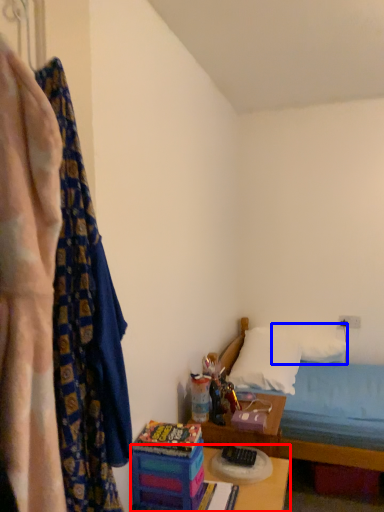
Question: Which point is closer to the camera, table (highlighted by a red box) or pillow (highlighted by a blue box)?

Choices:
 (A) table
 (B) pillow

Answer: (A)